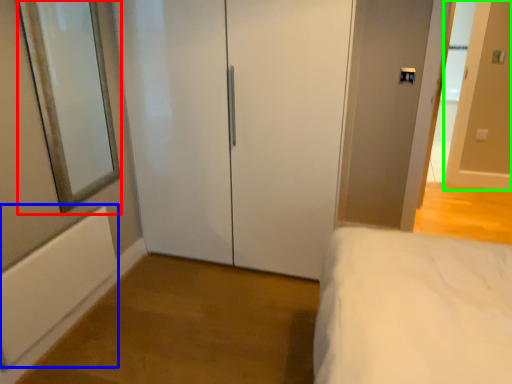
Question: Considering the real-world distances, which object is farthest from mirror (highlighted by a red box)? radiator (highlighted by a blue box) or door (highlighted by a green box)?

Choices:
 (A) radiator
 (B) door

Answer: (B)